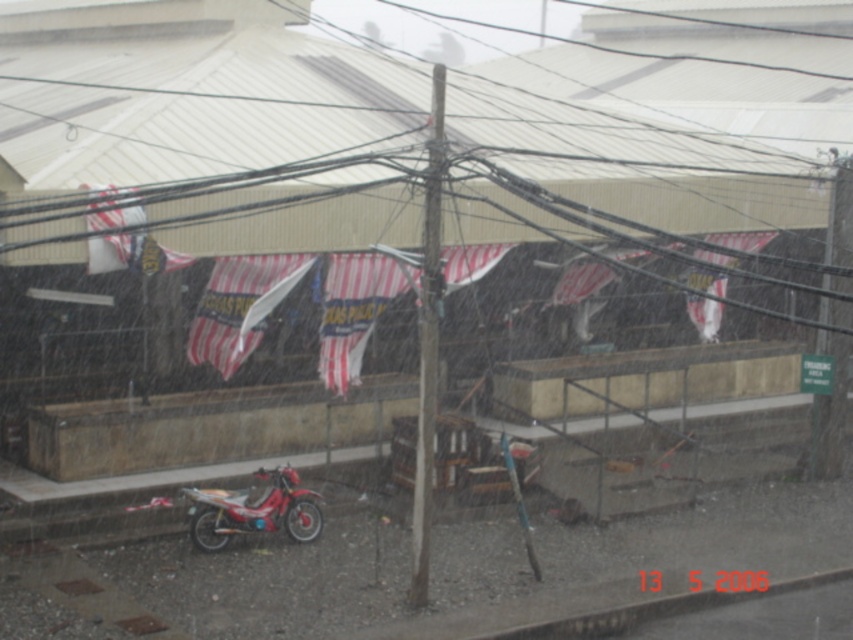
You are a delivery person trying to avoid getting wet in the rain. You see the smooth wooden pole at center and the shiny red motorcycle at lower left. Which object can you stand behind to stay dry from the rain?

The smooth wooden pole at center has a greater height compared to the shiny red motorcycle at lower left, so you can stand behind the smooth wooden pole at center to stay dry from the rain.

Looking at this image, you are a delivery person who needs to secure a package between the smooth wooden pole at center and the shiny red motorcycle at lower left. Which object should you use as the base for securing the package?

The smooth wooden pole at center is thinner than the shiny red motorcycle at lower left, so you should use the shiny red motorcycle at lower left as the base for securing the package because it has a wider surface area.

You are standing in the middle of the rainy urban scene and want to take a photo of the smooth wooden pole at center. Where should you point your camera to capture it?

You should point your camera towards the center of the scene at coordinates point (428, 340) to capture the smooth wooden pole at center.